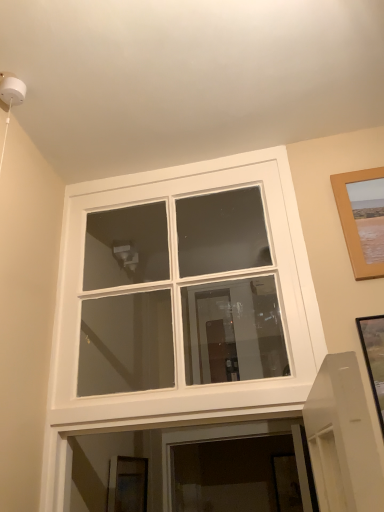
Question: In terms of size, does white glass window at center appear bigger or smaller than wooden picture frame at upper right, which is counted as the second picture frame, starting from the left?

Choices:
 (A) small
 (B) big

Answer: (B)

Question: From the image's perspective, relative to wooden picture frame at upper right, which ranks as the first picture frame in front-to-back order, is white glass window at center above or below?

Choices:
 (A) below
 (B) above

Answer: (A)

Question: Based on their relative distances, which object is farther from the wooden picture frame at upper right, the first picture frame from the right?

Choices:
 (A) white glass window at center
 (B) wooden picture frame at lower center, placed as the 1th picture frame when sorted from left to right

Answer: (B)

Question: Which object is the closest to the white glass window at center?

Choices:
 (A) wooden picture frame at upper right, arranged as the first picture frame when viewed from the top
 (B) wooden picture frame at lower center, placed as the 1th picture frame when sorted from left to right

Answer: (B)